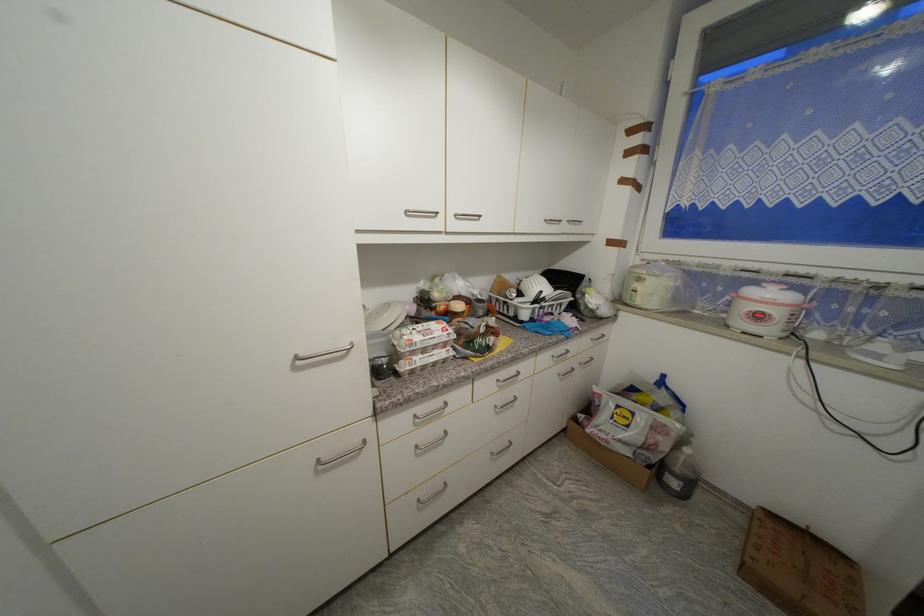
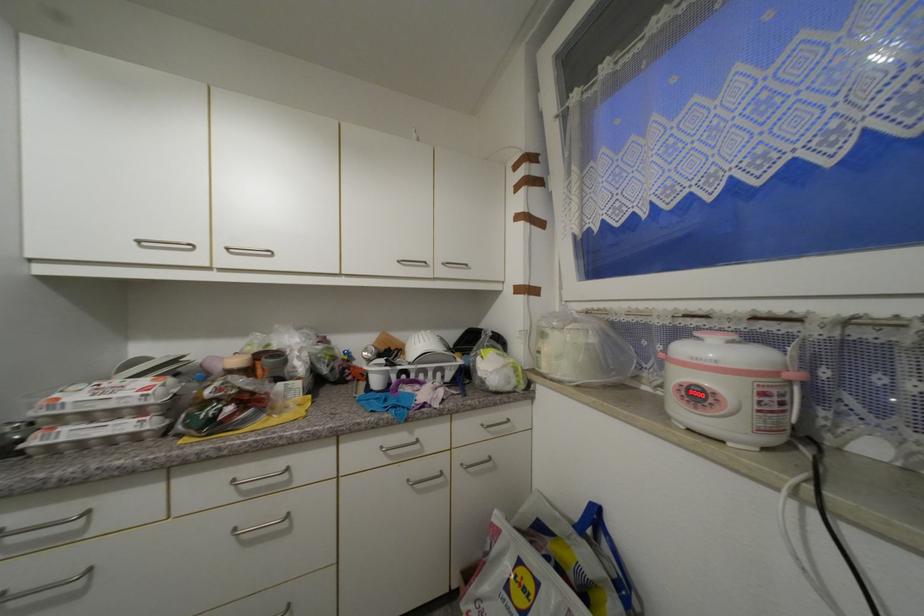
What movement of the cameraman would produce the second image?

The cameraman moved toward right, forward.